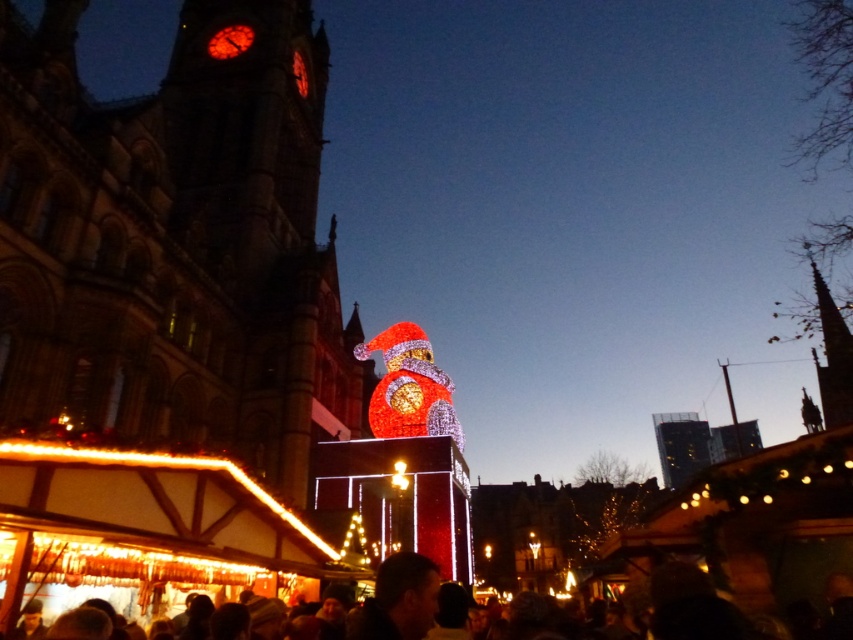
Is stone clock tower at upper left below dark brown hair at lower center?

No, stone clock tower at upper left is not below dark brown hair at lower center.

Consider the image. Which is more to the right, stone clock tower at upper left or dark brown hair at lower center?

Positioned to the right is dark brown hair at lower center.

I want to click on stone clock tower at upper left, so click(x=175, y=243).

This screenshot has width=853, height=640. Find the location of `stone clock tower at upper left`. stone clock tower at upper left is located at coordinates (175, 243).